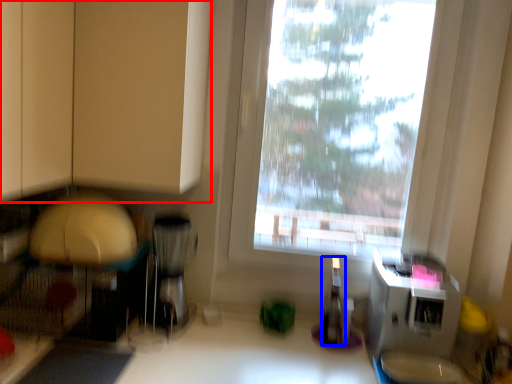
Question: Which of the following is the farthest to the observer, cabinetry (highlighted by a red box) or bottle (highlighted by a blue box)?

Choices:
 (A) cabinetry
 (B) bottle

Answer: (B)